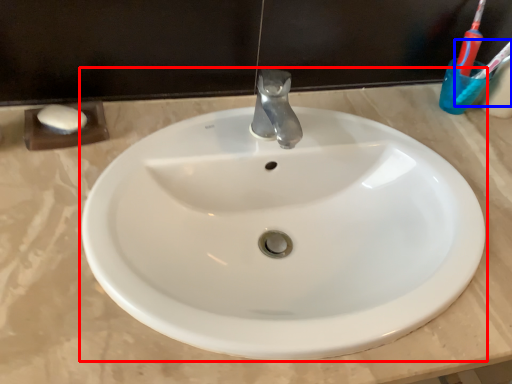
Question: Which point is further to the camera, sink (highlighted by a red box) or toothbrush (highlighted by a blue box)?

Choices:
 (A) sink
 (B) toothbrush

Answer: (B)